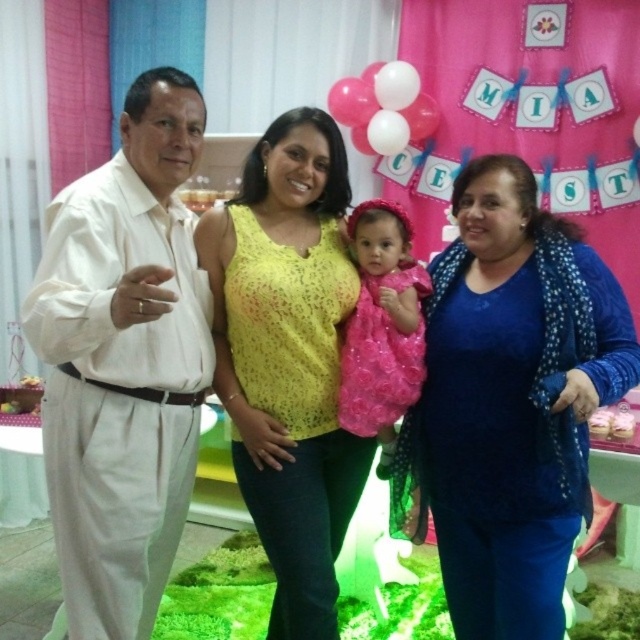
You are a photographer at a birthday party. You need to adjust the lighting between the blue textured sweater at center and the white cotton shirt at left so that both are equally illuminated. Given that they are 31.54 inches apart, what is the minimum distance you should set the spotlight to cover to ensure both are fully lit?

The minimum distance the spotlight should cover is at least 31.54 inches to ensure both the blue textured sweater at center and the white cotton shirt at left are fully illuminated.

You are a photographer at a birthday party and need to decide which outfit to recommend for the next photo. You see the yellow lace top at center and the pink satin dress at center. Which one has a larger size?

The yellow lace top at center is bigger than the pink satin dress at center, so the yellow lace top at center has a larger size.

You are standing in the room and want to move from point A to point B. Point A is at coordinates point (337, 225) and point B is at coordinates point (376, 230). Which point is closer to you?

Point A at coordinates point (337, 225) is closer to you since it is further to the viewer than point B at coordinates point (376, 230).